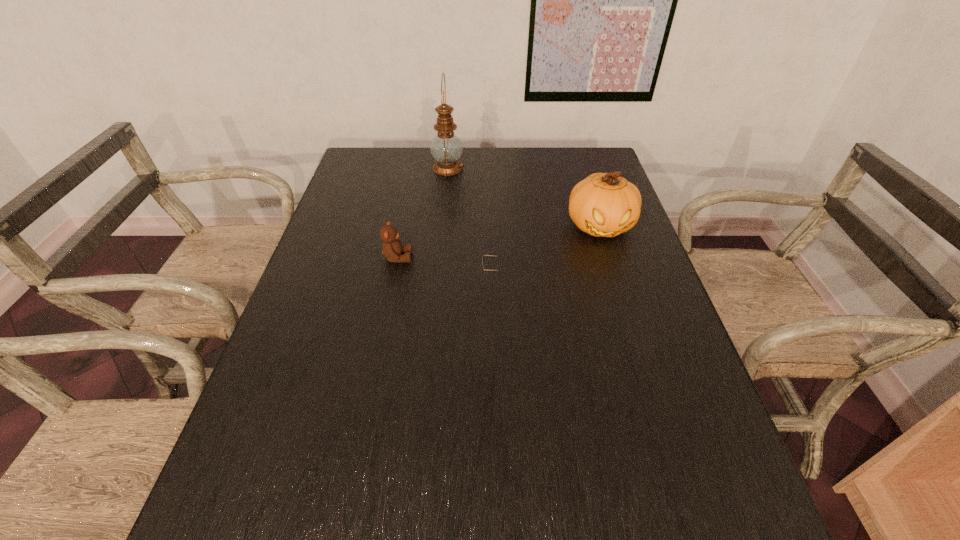
Locate an element on the screen. This screenshot has height=540, width=960. oil lamp is located at coordinates (446, 148).

Identify the location of the farthest object. (446, 148).

Where is `the rightmost object`? The width and height of the screenshot is (960, 540). the rightmost object is located at coordinates (604, 205).

Where is `the third shortest object`? the third shortest object is located at coordinates (604, 205).

Locate an element on the screen. The image size is (960, 540). teddy bear is located at coordinates (391, 248).

Locate an element on the screen. Image resolution: width=960 pixels, height=540 pixels. the third tallest object is located at coordinates (391, 248).

What are the coordinates of `the shortest object` in the screenshot? It's located at (483, 255).

This screenshot has height=540, width=960. I want to click on sunglasses, so click(483, 255).

Locate an element on the screen. This screenshot has height=540, width=960. free space located on the right of the second object from left to right is located at coordinates (580, 168).

Identify the location of vacant space located 0.340m on the front face of the rightmost object. This screenshot has height=540, width=960. (639, 348).